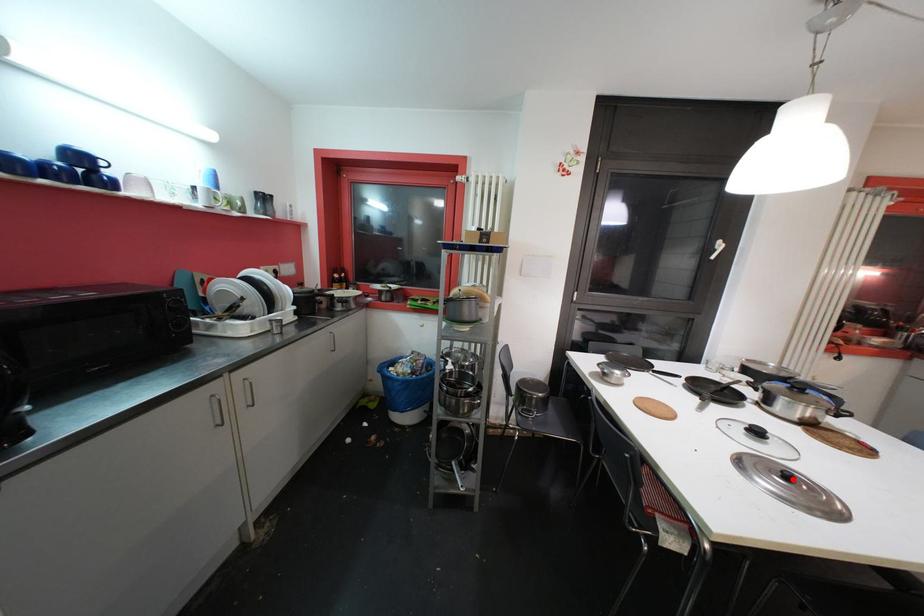
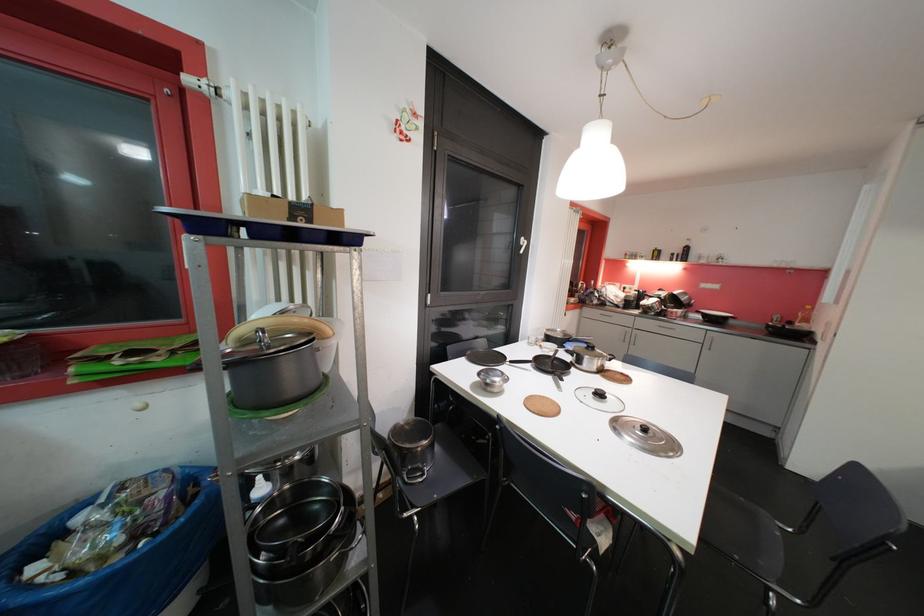
Find the pixel in the second image that matches the highlighted location in the first image.

(650, 432)